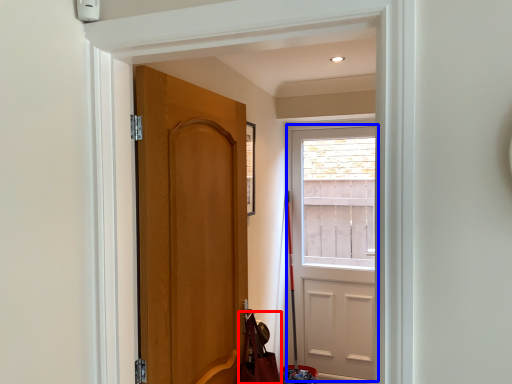
Question: Which of the following is the farthest to the observer, shoulder bag (highlighted by a red box) or door (highlighted by a blue box)?

Choices:
 (A) shoulder bag
 (B) door

Answer: (B)